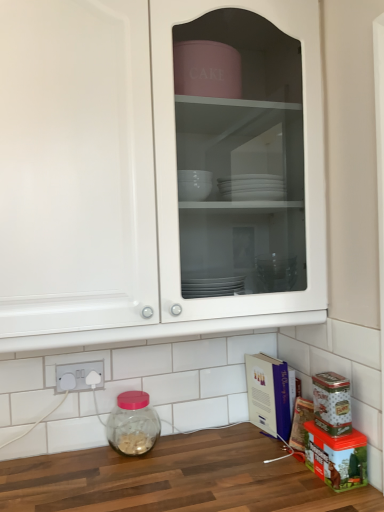
What do you see at coordinates (133, 424) in the screenshot? This screenshot has height=512, width=384. I see `transparent glass jar at lower left` at bounding box center [133, 424].

This screenshot has width=384, height=512. What do you see at coordinates (120, 175) in the screenshot?
I see `white glossy cabinet at upper center` at bounding box center [120, 175].

At what (x,y) coordinates should I click in order to perform the action: click on transparent glass jar at lower left. Please return your answer as a coordinate pair (x, y). Looking at the image, I should click on (133, 424).

Find the location of `glass jar that is below the white plastic electric outlet at lower left (from the image's perspective)`. glass jar that is below the white plastic electric outlet at lower left (from the image's perspective) is located at coordinates (133, 424).

From the image's perspective, who appears lower, white plastic electric outlet at lower left or transparent glass jar at lower left?

From the image's view, transparent glass jar at lower left is below.

Is white plastic electric outlet at lower left taller than transparent glass jar at lower left?

No.

Does white plastic electric outlet at lower left have a smaller size compared to cardboard box at lower right?

Yes, white plastic electric outlet at lower left is smaller than cardboard box at lower right.

Is white plastic electric outlet at lower left to the left of cardboard box at lower right from the viewer's perspective?

Yes.

Consider the image. Which is closer to the camera, (x=87, y=382) or (x=272, y=377)?

Clearly, point (x=87, y=382) is closer to the camera than point (x=272, y=377).

Is white plastic electric outlet at lower left positioned far away from cardboard box at lower right?

Actually, white plastic electric outlet at lower left and cardboard box at lower right are a little close together.

Considering the positions of objects cardboard box at lower right and transparent glass jar at lower left in the image provided, who is behind, cardboard box at lower right or transparent glass jar at lower left?

Positioned behind is cardboard box at lower right.

Considering the relative sizes of cardboard box at lower right and transparent glass jar at lower left in the image provided, is cardboard box at lower right thinner than transparent glass jar at lower left?

In fact, cardboard box at lower right might be wider than transparent glass jar at lower left.

Is cardboard box at lower right smaller than transparent glass jar at lower left?

Incorrect, cardboard box at lower right is not smaller in size than transparent glass jar at lower left.

Is cardboard box at lower right facing towards white plastic electric outlet at lower left?

Yes, cardboard box at lower right faces towards white plastic electric outlet at lower left.

From the image's perspective, is cardboard box at lower right over white plastic electric outlet at lower left?

No.

Is cardboard box at lower right wider than white plastic electric outlet at lower left?

Indeed, cardboard box at lower right has a greater width compared to white plastic electric outlet at lower left.

From the picture: Would you say cardboard box at lower right is outside white plastic electric outlet at lower left?

Indeed, cardboard box at lower right is completely outside white plastic electric outlet at lower left.

Would you say white glossy cabinet at upper center is to the left or to the right of cardboard box at lower right in the picture?

From the image, it's evident that white glossy cabinet at upper center is to the left of cardboard box at lower right.

From the picture: From the image's perspective, which is below, white glossy cabinet at upper center or cardboard box at lower right?

From the image's view, cardboard box at lower right is below.

Is there a large distance between white glossy cabinet at upper center and cardboard box at lower right?

No, white glossy cabinet at upper center is in close proximity to cardboard box at lower right.

Considering the positions of objects white glossy cabinet at upper center and cardboard box at lower right in the image provided, who is behind, white glossy cabinet at upper center or cardboard box at lower right?

cardboard box at lower right is behind.

Is transparent glass jar at lower left touching white plastic electric outlet at lower left?

transparent glass jar at lower left and white plastic electric outlet at lower left are clearly separated.

Is transparent glass jar at lower left at the right side of white plastic electric outlet at lower left?

Indeed, transparent glass jar at lower left is positioned on the right side of white plastic electric outlet at lower left.

Is transparent glass jar at lower left surrounding white plastic electric outlet at lower left?

No, white plastic electric outlet at lower left is not a part of transparent glass jar at lower left.

From a real-world perspective, between transparent glass jar at lower left and white plastic electric outlet at lower left, who is vertically higher?

white plastic electric outlet at lower left is physically above.

Is white plastic electric outlet at lower left beside white glossy cabinet at upper center?

They are not placed beside each other.

Which object is closer to the camera, white plastic electric outlet at lower left or white glossy cabinet at upper center?

white glossy cabinet at upper center.

Does white plastic electric outlet at lower left have a greater height compared to white glossy cabinet at upper center?

No.

The height and width of the screenshot is (512, 384). In the image, there is a white plastic electric outlet at lower left. Find the location of `glass jar below it (from a real-world perspective)`. glass jar below it (from a real-world perspective) is located at coordinates (133, 424).

Identify the location of electric outlet that appears in front of the cardboard box at lower right. (80, 376).

Looking at the image, which one is located further to cardboard box at lower right, white plastic electric outlet at lower left or white glossy cabinet at upper center?

Among the two, white glossy cabinet at upper center is located further to cardboard box at lower right.

When comparing their distances from white glossy cabinet at upper center, does white plastic electric outlet at lower left or transparent glass jar at lower left seem closer?

white plastic electric outlet at lower left is closer to white glossy cabinet at upper center.

Consider the image. Estimate the real-world distances between objects in this image. Which object is further from white glossy cabinet at upper center, transparent glass jar at lower left or cardboard box at lower right?

cardboard box at lower right lies further to white glossy cabinet at upper center than the other object.

Estimate the real-world distances between objects in this image. Which object is further from white glossy cabinet at upper center, cardboard box at lower right or white plastic electric outlet at lower left?

cardboard box at lower right is further to white glossy cabinet at upper center.

From the picture: From the image, which object appears to be nearer to transparent glass jar at lower left, cardboard box at lower right or white glossy cabinet at upper center?

cardboard box at lower right is positioned closer to the anchor transparent glass jar at lower left.

From the image, which object appears to be farther from cardboard box at lower right, white plastic electric outlet at lower left or transparent glass jar at lower left?

Based on the image, white plastic electric outlet at lower left appears to be further to cardboard box at lower right.

When comparing their distances from white glossy cabinet at upper center, does transparent glass jar at lower left or white plastic electric outlet at lower left seem further?

Based on the image, transparent glass jar at lower left appears to be further to white glossy cabinet at upper center.

Considering their positions, is white plastic electric outlet at lower left positioned closer to transparent glass jar at lower left than cardboard box at lower right?

white plastic electric outlet at lower left.

Locate an element on the screen. cardboard box that lies between white glossy cabinet at upper center and transparent glass jar at lower left from top to bottom is located at coordinates 268,394.

You are a GUI agent. You are given a task and a screenshot of the screen. Output one action in this format:
    pyautogui.click(x=<x>, y=<y>)
    Task: Click on the electric outlet that lies between white glossy cabinet at upper center and cardboard box at lower right from top to bottom
    
    Given the screenshot: What is the action you would take?
    pyautogui.click(x=80, y=376)

You are a GUI agent. You are given a task and a screenshot of the screen. Output one action in this format:
    pyautogui.click(x=<x>, y=<y>)
    Task: Click on the electric outlet between white glossy cabinet at upper center and transparent glass jar at lower left from top to bottom
    
    Given the screenshot: What is the action you would take?
    pyautogui.click(x=80, y=376)

At what (x,y) coordinates should I click in order to perform the action: click on glass jar between white plastic electric outlet at lower left and cardboard box at lower right in the horizontal direction. Please return your answer as a coordinate pair (x, y). Looking at the image, I should click on (133, 424).